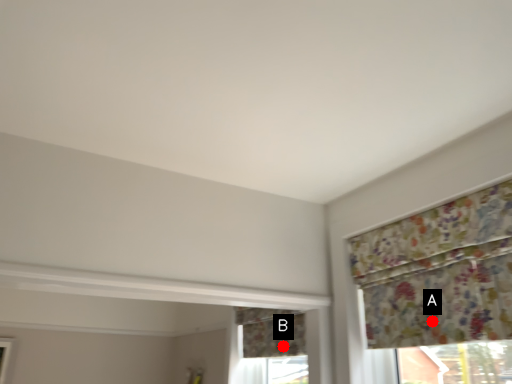
Question: Two points are circled on the image, labeled by A and B beside each circle. Which point appears closest to the camera in this image?

Choices:
 (A) A is closer
 (B) B is closer

Answer: (A)